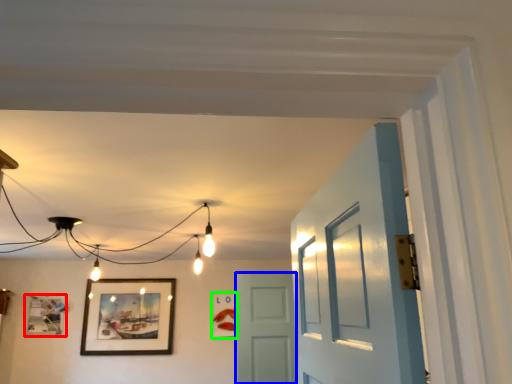
Question: Which object is positioned closest to picture frame (highlighted by a red box)? Select from door (highlighted by a blue box) and picture frame (highlighted by a green box).

Choices:
 (A) door
 (B) picture frame

Answer: (B)